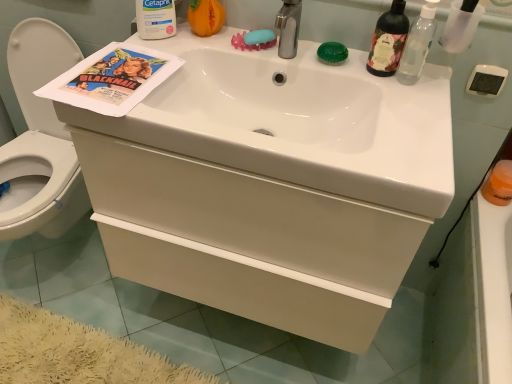
Locate an element on the screen. vacant space that is in between blue rubber soap at upper center, the 1th soap positioned from the left, and green translucent soap at upper center, the second soap viewed from the left is located at coordinates (296, 52).